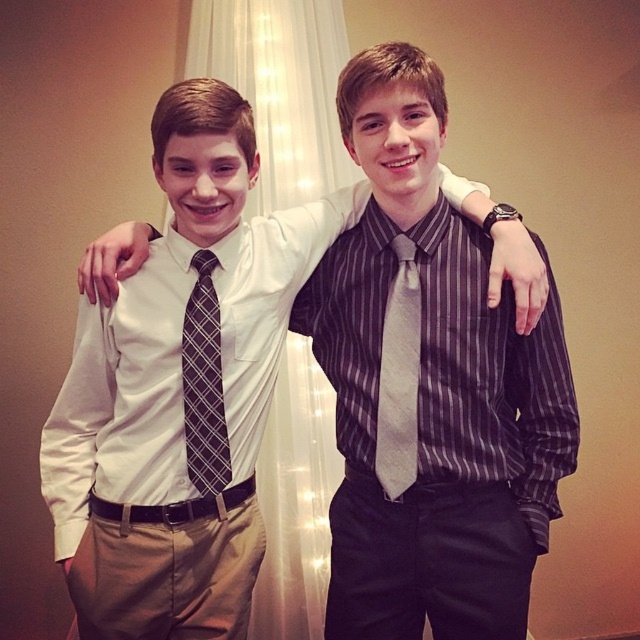
Question: Which of the following is the farthest from the observer?

Choices:
 (A) white sheer curtain at center
 (B) plaid fabric tie at center
 (C) silky gray tie at center

Answer: (A)

Question: Estimate the real-world distances between objects in this image. Which object is closer to the plaid fabric tie at center?

Choices:
 (A) white sheer curtain at center
 (B) silky gray tie at center

Answer: (B)

Question: Is silky gray tie at center thinner than plaid fabric tie at center?

Choices:
 (A) no
 (B) yes

Answer: (A)

Question: Is white sheer curtain at center thinner than silky gray tie at center?

Choices:
 (A) yes
 (B) no

Answer: (B)

Question: Considering the relative positions of silky gray tie at center and plaid fabric tie at center in the image provided, where is silky gray tie at center located with respect to plaid fabric tie at center?

Choices:
 (A) right
 (B) left

Answer: (A)

Question: Estimate the real-world distances between objects in this image. Which object is closer to the white sheer curtain at center?

Choices:
 (A) plaid fabric tie at center
 (B) silky gray tie at center

Answer: (A)